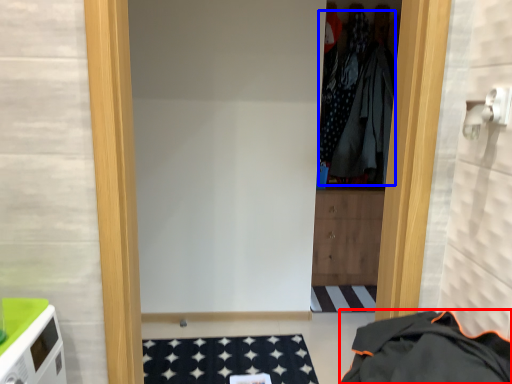
Question: Which object appears farthest to the camera in this image, clothing (highlighted by a red box) or clothing (highlighted by a blue box)?

Choices:
 (A) clothing
 (B) clothing

Answer: (B)